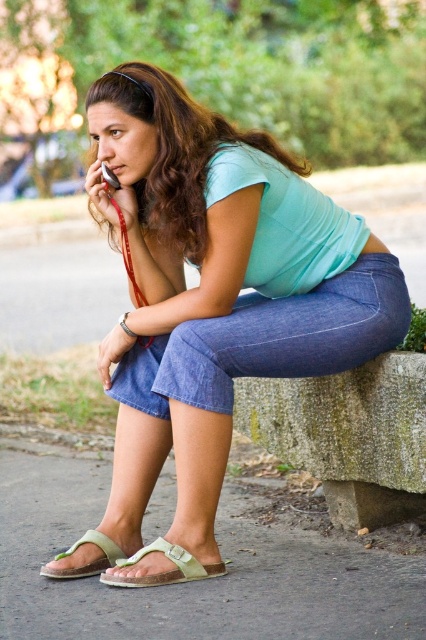
Does point (244, 252) lie in front of point (60, 554)?

Yes, point (244, 252) is closer to viewer.

Between denim pants at lower center and green suede sandal at lower left, which one has less height?

Standing shorter between the two is green suede sandal at lower left.

Locate an element on the screen. The height and width of the screenshot is (640, 426). denim pants at lower center is located at coordinates (216, 289).

Find the location of a particular element. The image size is (426, 640). denim pants at lower center is located at coordinates (216, 289).

Consider the image. Does green cork sandal at lower center come behind green suede sandal at lower left?

No, green cork sandal at lower center is in front of green suede sandal at lower left.

Can you confirm if green cork sandal at lower center is positioned above green suede sandal at lower left?

Indeed, green cork sandal at lower center is positioned over green suede sandal at lower left.

At what (x,y) coordinates should I click in order to perform the action: click on green cork sandal at lower center. Please return your answer as a coordinate pair (x, y). Image resolution: width=426 pixels, height=640 pixels. Looking at the image, I should click on (164, 572).

The height and width of the screenshot is (640, 426). I want to click on green cork sandal at lower center, so click(164, 572).

Does denim at left come behind green suede sandal at lower left?

No, it is in front of green suede sandal at lower left.

Is denim at left to the right of green suede sandal at lower left from the viewer's perspective?

Yes, denim at left is to the right of green suede sandal at lower left.

Is point (236, 301) more distant than point (117, 556)?

Yes, point (236, 301) is farther from viewer.

Where is `denim at left`? denim at left is located at coordinates (270, 340).